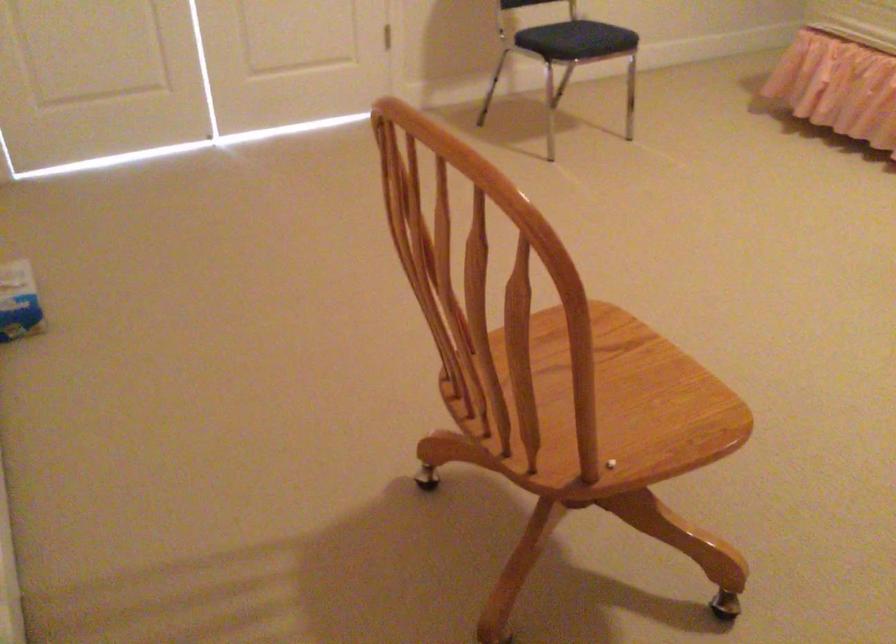
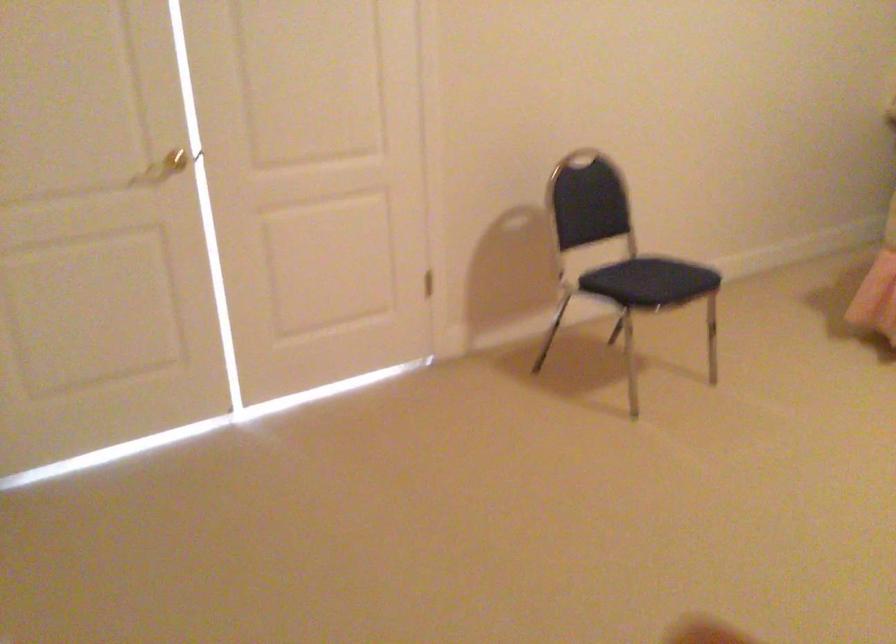
Question: The first image is from the beginning of the video and the second image is from the end. How did the camera likely rotate when shooting the video?

Choices:
 (A) Left
 (B) Right
 (C) Up
 (D) Down

Answer: (C)